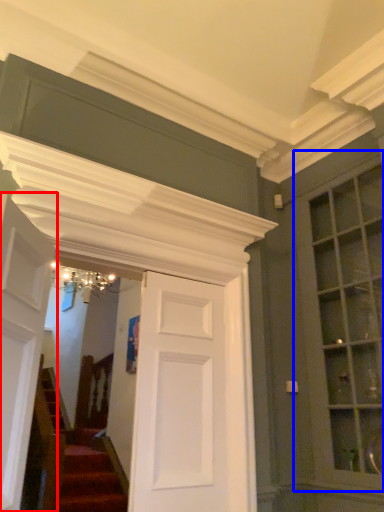
Question: Which point is closer to the camera, door (highlighted by a red box) or window (highlighted by a blue box)?

Choices:
 (A) door
 (B) window

Answer: (A)